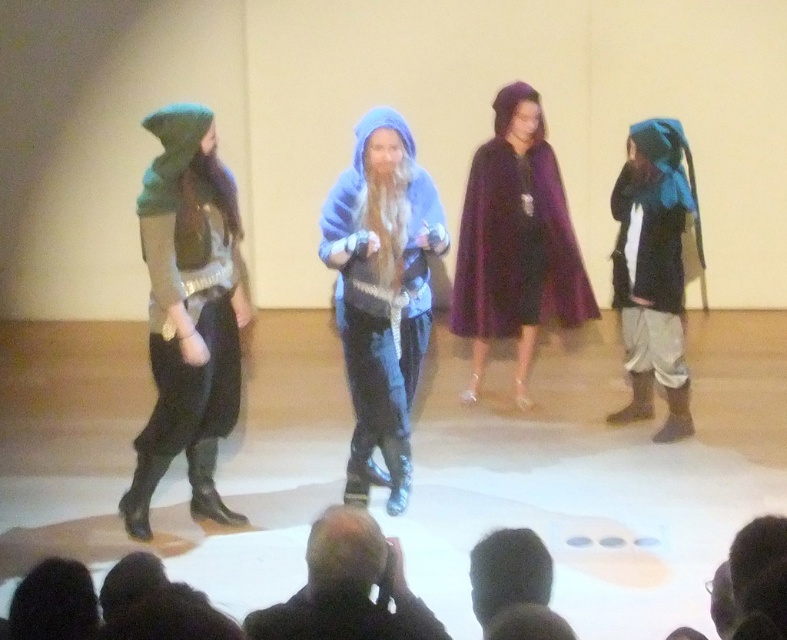
Consider the image. You are a photographer at the back of the audience. You want to capture both the fuzzy blue hoodie at center and the blue felt hood at right in a single photo. Which costume should you focus on to ensure both are visible in the frame?

The fuzzy blue hoodie at center is much taller than the blue felt hood at right, so focusing on the fuzzy blue hoodie at center will ensure both are visible in the frame.

You are a photographer in the audience. You need to capture a clear photo of both the black hair at lower center and the black hair at lower left. Which one might be easier to focus on due to its size?

The black hair at lower center is bigger than the black hair at lower left, so it might be easier to focus on due to its larger size.